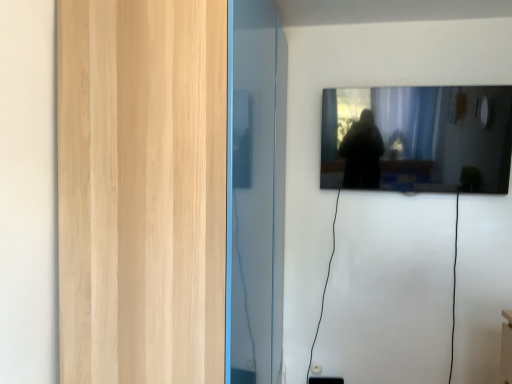
What do you see at coordinates (142, 190) in the screenshot?
I see `transparent glass door at left` at bounding box center [142, 190].

Identify the location of transparent glass door at left. (142, 190).

This screenshot has height=384, width=512. I want to click on black glossy mirror at upper right, so click(x=418, y=139).

Describe the element at coordinates (418, 139) in the screenshot. This screenshot has height=384, width=512. I see `black glossy mirror at upper right` at that location.

Locate an element on the screen. transparent glass door at left is located at coordinates (142, 190).

Which object is positioned more to the right, transparent glass door at left or black glossy mirror at upper right?

Positioned to the right is black glossy mirror at upper right.

In the scene shown: Is transparent glass door at left closer to the viewer compared to black glossy mirror at upper right?

Yes, the depth of transparent glass door at left is less than that of black glossy mirror at upper right.

Considering the points (162, 365) and (455, 87), which point is behind, point (162, 365) or point (455, 87)?

The point (455, 87) is farther.

From the image's perspective, would you say transparent glass door at left is shown under black glossy mirror at upper right?

Yes, from the image's perspective, transparent glass door at left is below black glossy mirror at upper right.

From a real-world perspective, is transparent glass door at left positioned over black glossy mirror at upper right based on gravity?

No, from a real-world perspective, transparent glass door at left is not above black glossy mirror at upper right.

Considering the relative sizes of transparent glass door at left and black glossy mirror at upper right in the image provided, is transparent glass door at left thinner than black glossy mirror at upper right?

No.

Is transparent glass door at left shorter than black glossy mirror at upper right?

Incorrect, the height of transparent glass door at left does not fall short of that of black glossy mirror at upper right.

Between transparent glass door at left and black glossy mirror at upper right, which one has larger size?

Bigger between the two is transparent glass door at left.

Is transparent glass door at left positioned beyond the bounds of black glossy mirror at upper right?

Yes, transparent glass door at left is located beyond the bounds of black glossy mirror at upper right.

Is transparent glass door at left in contact with black glossy mirror at upper right?

No, transparent glass door at left is not beside black glossy mirror at upper right.

Is transparent glass door at left looking in the opposite direction of black glossy mirror at upper right?

transparent glass door at left does not have its back to black glossy mirror at upper right.

The image size is (512, 384). What are the coordinates of `mirror above the transparent glass door at left (from a real-world perspective)` in the screenshot? It's located at (418, 139).

Is black glossy mirror at upper right at the left side of transparent glass door at left?

No, black glossy mirror at upper right is not to the left of transparent glass door at left.

From the picture: Is black glossy mirror at upper right positioned in front of transparent glass door at left?

No, black glossy mirror at upper right is further to the viewer.

Which is farther, (467,120) or (65,215)?

The point (467,120) is farther from the camera.

From the image's perspective, is black glossy mirror at upper right under transparent glass door at left?

No, from the image's perspective, black glossy mirror at upper right is not below transparent glass door at left.

From a real-world perspective, is black glossy mirror at upper right located higher than transparent glass door at left?

Yes, from a real-world perspective, black glossy mirror at upper right is on top of transparent glass door at left.

Considering the sizes of objects black glossy mirror at upper right and transparent glass door at left in the image provided, who is thinner, black glossy mirror at upper right or transparent glass door at left?

black glossy mirror at upper right.

Considering the sizes of objects black glossy mirror at upper right and transparent glass door at left in the image provided, who is shorter, black glossy mirror at upper right or transparent glass door at left?

With less height is black glossy mirror at upper right.

Is black glossy mirror at upper right smaller than transparent glass door at left?

Indeed, black glossy mirror at upper right has a smaller size compared to transparent glass door at left.

Is transparent glass door at left inside black glossy mirror at upper right?

No, black glossy mirror at upper right does not contain transparent glass door at left.

Would you consider black glossy mirror at upper right to be distant from transparent glass door at left?

Yes, black glossy mirror at upper right is far from transparent glass door at left.

Could you tell me if black glossy mirror at upper right is turned towards transparent glass door at left?

No, black glossy mirror at upper right is not oriented towards transparent glass door at left.

How many degrees apart are the facing directions of black glossy mirror at upper right and transparent glass door at left?

There is a 91-degree angle between the facing directions of black glossy mirror at upper right and transparent glass door at left.

Find the location of a particular element. The width and height of the screenshot is (512, 384). mirror positioned vertically above the transparent glass door at left (from a real-world perspective) is located at coordinates (418, 139).

This screenshot has width=512, height=384. What are the coordinates of `mirror above the transparent glass door at left (from a real-world perspective)` in the screenshot? It's located at (418, 139).

Locate an element on the screen. mirror located behind the transparent glass door at left is located at coordinates (418, 139).